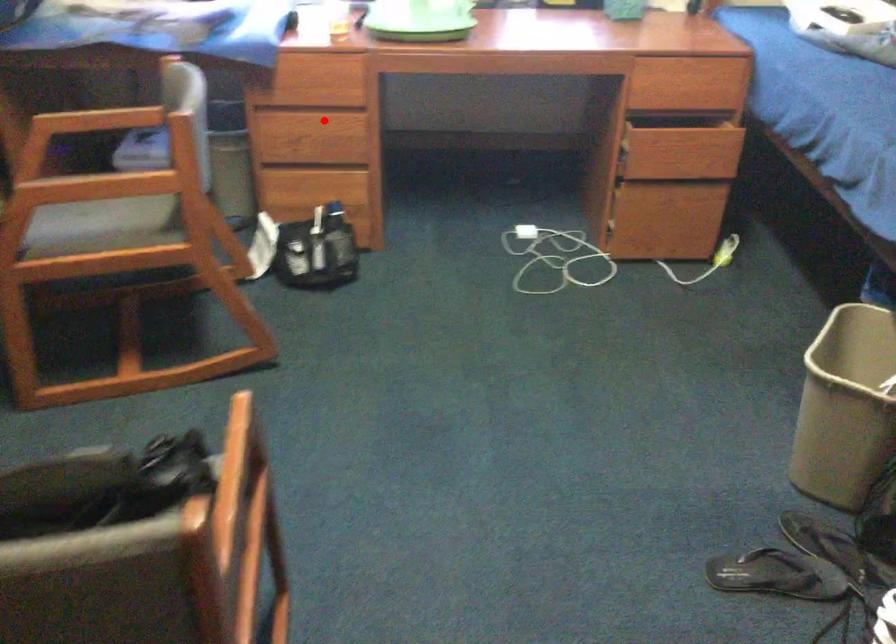
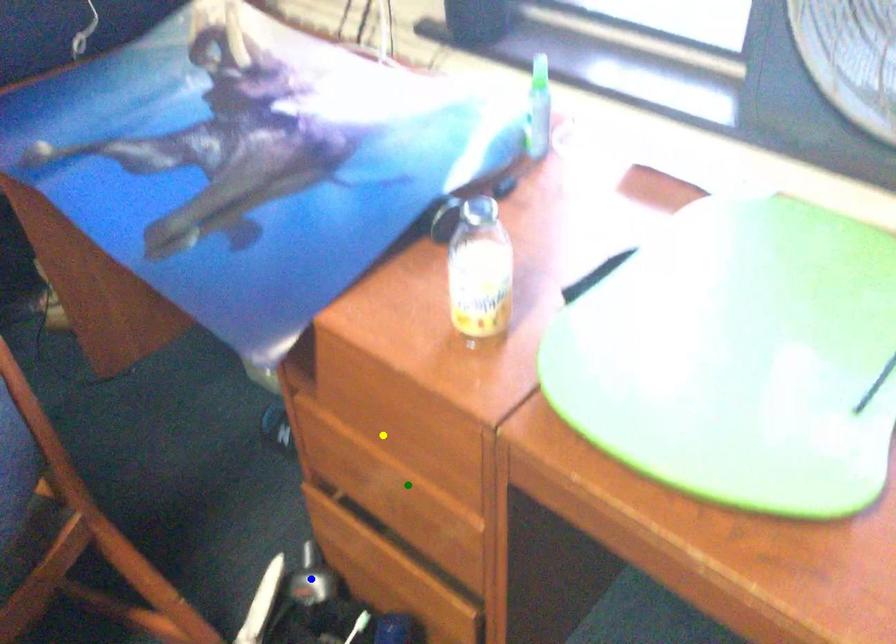
Question: I am providing you with two images of the same scene from different viewpoints. A red point is marked on the first image. You are given multiple points on the second image. Which mark in image 2 goes with the point in image 1?

Choices:
 (A) yellow point
 (B) green point
 (C) blue point

Answer: (B)